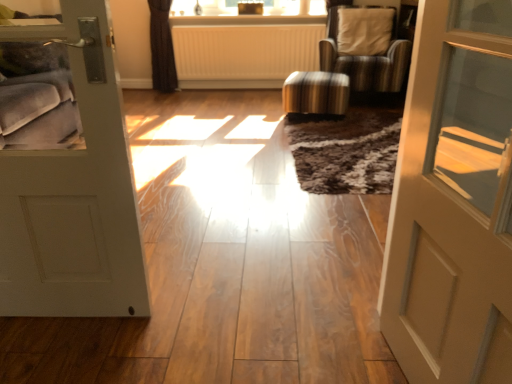
Question: From a real-world perspective, is white matte door at left, placed as the second door when sorted from right to left, located beneath matte beige door at right, the 1th door in the right-to-left sequence?

Choices:
 (A) yes
 (B) no

Answer: (A)

Question: From the image's perspective, is white matte door at left, placed as the second door when sorted from right to left, on top of matte beige door at right, the 1th door in the right-to-left sequence?

Choices:
 (A) no
 (B) yes

Answer: (B)

Question: Considering the relative sizes of white matte door at left, placed as the second door when sorted from right to left, and matte beige door at right, marked as the second door in a left-to-right arrangement, in the image provided, is white matte door at left, placed as the second door when sorted from right to left, wider than matte beige door at right, marked as the second door in a left-to-right arrangement,?

Choices:
 (A) yes
 (B) no

Answer: (B)

Question: Is white matte door at left, the 1th door viewed from the left, next to matte beige door at right, marked as the second door in a left-to-right arrangement?

Choices:
 (A) no
 (B) yes

Answer: (A)

Question: Is white matte door at left, the 1th door viewed from the left, facing towards matte beige door at right, the 1th door in the right-to-left sequence?

Choices:
 (A) yes
 (B) no

Answer: (B)

Question: Is white matte door at left, placed as the second door when sorted from right to left, looking in the opposite direction of matte beige door at right, marked as the second door in a left-to-right arrangement?

Choices:
 (A) yes
 (B) no

Answer: (B)

Question: Is striped fabric stool at center far from white matte door at left, the 1th door viewed from the left?

Choices:
 (A) yes
 (B) no

Answer: (A)

Question: Can you confirm if striped fabric stool at center is positioned to the right of white matte door at left, the 1th door viewed from the left?

Choices:
 (A) yes
 (B) no

Answer: (A)

Question: Is striped fabric stool at center to the left of white matte door at left, placed as the second door when sorted from right to left, from the viewer's perspective?

Choices:
 (A) no
 (B) yes

Answer: (A)

Question: From the image's perspective, does striped fabric stool at center appear lower than white matte door at left, placed as the second door when sorted from right to left?

Choices:
 (A) no
 (B) yes

Answer: (A)

Question: Is white matte door at left, placed as the second door when sorted from right to left, surrounded by striped fabric stool at center?

Choices:
 (A) yes
 (B) no

Answer: (B)

Question: Does striped fabric stool at center turn towards white matte door at left, the 1th door viewed from the left?

Choices:
 (A) yes
 (B) no

Answer: (A)

Question: Is striped fabric stool at center oriented away from white ribbed radiator at center?

Choices:
 (A) no
 (B) yes

Answer: (B)